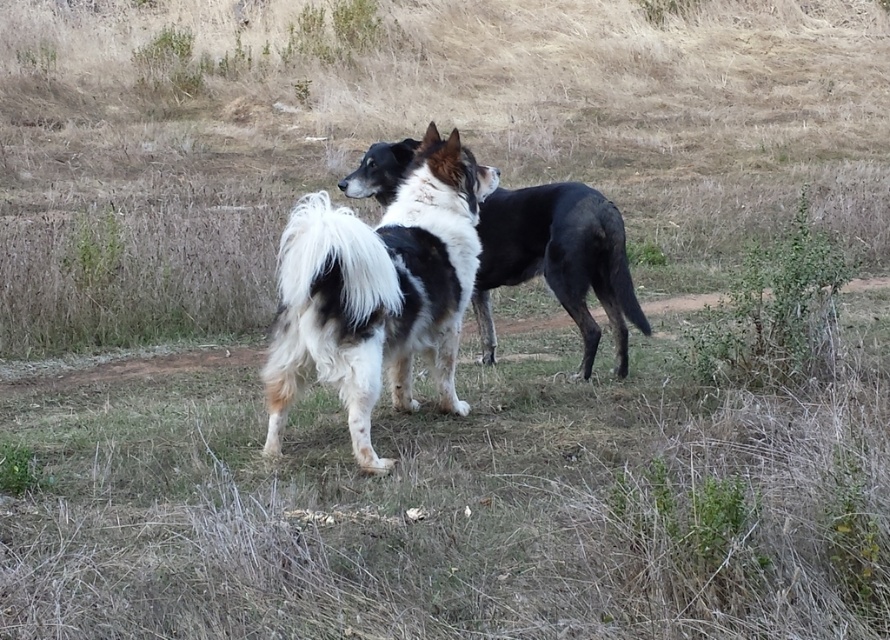
Which of these two, brown dry grass at center or black and white fur dog at center, stands shorter?

brown dry grass at center is shorter.

Does brown dry grass at center appear over black and white fur dog at center?

Actually, brown dry grass at center is below black and white fur dog at center.

Who is more distant from viewer, (619, 404) or (573, 282)?

The point (573, 282) is more distant.

What are the coordinates of `brown dry grass at center` in the screenshot? It's located at (462, 509).

In the scene shown: Does white fluffy dog at center appear over black and white fur dog at center?

Actually, white fluffy dog at center is below black and white fur dog at center.

You are a GUI agent. You are given a task and a screenshot of the screen. Output one action in this format:
    pyautogui.click(x=<x>, y=<y>)
    Task: Click on the white fluffy dog at center
    Image resolution: width=890 pixels, height=640 pixels.
    Given the screenshot: What is the action you would take?
    pyautogui.click(x=377, y=292)

I want to click on white fluffy dog at center, so click(377, 292).

Does brown dry grass at center appear on the right side of white fluffy dog at center?

Indeed, brown dry grass at center is positioned on the right side of white fluffy dog at center.

Image resolution: width=890 pixels, height=640 pixels. In order to click on brown dry grass at center in this screenshot , I will do `click(462, 509)`.